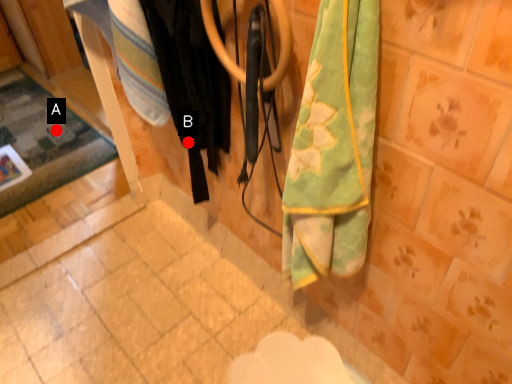
Question: Two points are circled on the image, labeled by A and B beside each circle. Which of the following is the farthest from the observer?

Choices:
 (A) A is further
 (B) B is further

Answer: (A)